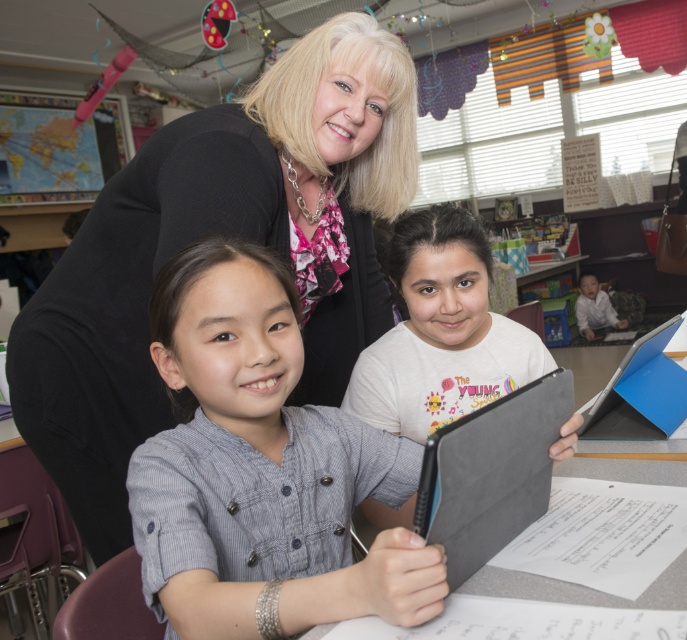
Question: Is black fabric at upper center thinner than gray button-down shirt at center?

Choices:
 (A) no
 (B) yes

Answer: (A)

Question: Does black fabric at upper center have a smaller size compared to gray matte tablet at center?

Choices:
 (A) no
 (B) yes

Answer: (A)

Question: Estimate the real-world distances between objects in this image. Which object is farther from the black fabric at upper center?

Choices:
 (A) matte gray tablet at center
 (B) gray button-down shirt at center
 (C) gray matte tablet at center
 (D) pink paper at upper left

Answer: (D)

Question: Which point is farther to the camera?

Choices:
 (A) coord(341,141)
 (B) coord(611,477)

Answer: (A)

Question: Does matte gray tablet at center lie in front of pink paper at upper left?

Choices:
 (A) yes
 (B) no

Answer: (A)

Question: Which point is closer to the camera taking this photo?

Choices:
 (A) [289, 276]
 (B) [60, 156]
 (C) [504, 572]
 (D) [394, 124]

Answer: (C)